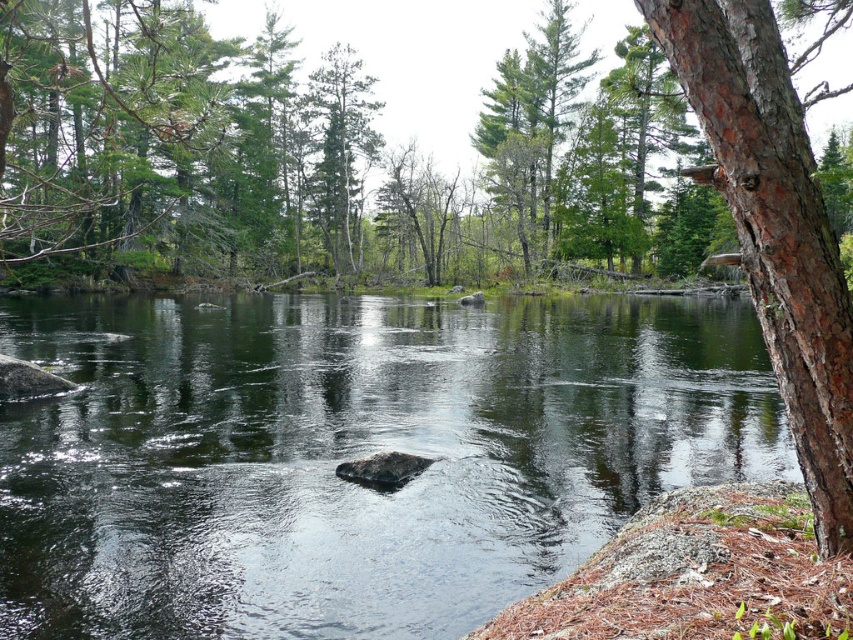
You are standing at the edge of the forest and see the transparent water at center and the green matte tree at center. Which object is closer to your right side?

The transparent water at center is to the right of green matte tree at center, so the transparent water at center is closer to your right side.